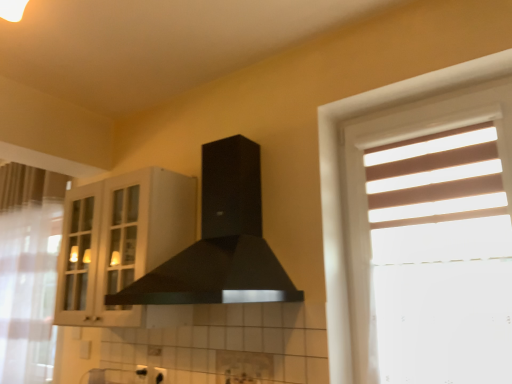
What is the approximate height of white sheer curtain at left?

It is 1.17 meters.

What do you see at coordinates (120, 241) in the screenshot?
I see `white glass cabinet at upper left` at bounding box center [120, 241].

The height and width of the screenshot is (384, 512). What do you see at coordinates (78, 256) in the screenshot?
I see `clear glass screen door at left` at bounding box center [78, 256].

Find the location of `white sheer curtain at left`. white sheer curtain at left is located at coordinates (28, 270).

Does point (70, 190) appear closer or farther from the camera than point (39, 317)?

Point (70, 190) appears to be closer to the viewer than point (39, 317).

Which is behind, white glass cabinet at upper left or white sheer curtain at left?

white sheer curtain at left is behind.

Is white glass cabinet at upper left spatially inside white sheer curtain at left, or outside of it?

white glass cabinet at upper left cannot be found inside white sheer curtain at left.

Is clear glass screen door at left a part of white glass cabinet at upper left?

That's incorrect, clear glass screen door at left is not inside white glass cabinet at upper left.

Consider the image. Are white glass cabinet at upper left and clear glass screen door at left making contact?

white glass cabinet at upper left and clear glass screen door at left are not in contact.

From a real-world perspective, is white glass cabinet at upper left beneath clear glass screen door at left?

Yes, from a real-world perspective, white glass cabinet at upper left is under clear glass screen door at left.

Can you confirm if white glass cabinet at upper left is thinner than clear glass screen door at left?

In fact, white glass cabinet at upper left might be wider than clear glass screen door at left.

In the scene shown: Between white glass cabinet at upper left and black matte fume hood at center, which one appears on the left side from the viewer's perspective?

white glass cabinet at upper left.

Considering the sizes of objects white glass cabinet at upper left and black matte fume hood at center in the image provided, who is smaller, white glass cabinet at upper left or black matte fume hood at center?

white glass cabinet at upper left.

Which is farther from the camera, [87,284] or [248,300]?

Point [87,284]

Considering the sizes of white glass cabinet at upper left and black matte fume hood at center in the image, is white glass cabinet at upper left taller or shorter than black matte fume hood at center?

In the image, white glass cabinet at upper left appears to be taller than black matte fume hood at center.

The image size is (512, 384). Identify the location of curtain below the clear glass screen door at left (from a real-world perspective). (28, 270).

Considering the relative sizes of white sheer curtain at left and clear glass screen door at left in the image provided, is white sheer curtain at left wider than clear glass screen door at left?

Yes, white sheer curtain at left is wider than clear glass screen door at left.

Can you confirm if white sheer curtain at left is smaller than clear glass screen door at left?

No, white sheer curtain at left is not smaller than clear glass screen door at left.

Can you tell me how much clear glass screen door at left and white sheer curtain at left differ in facing direction?

1.9 degrees separate the facing orientations of clear glass screen door at left and white sheer curtain at left.

Considering the sizes of objects clear glass screen door at left and white sheer curtain at left in the image provided, who is thinner, clear glass screen door at left or white sheer curtain at left?

clear glass screen door at left.

Which is behind, point (99, 191) or point (18, 282)?

The point (18, 282) is behind.

Considering the relative sizes of clear glass screen door at left and white sheer curtain at left in the image provided, is clear glass screen door at left shorter than white sheer curtain at left?

Correct, clear glass screen door at left is not as tall as white sheer curtain at left.

Is black matte fume hood at center not inside white sheer curtain at left?

Yes, black matte fume hood at center is not within white sheer curtain at left.

Does black matte fume hood at center turn towards white sheer curtain at left?

No, black matte fume hood at center does not turn towards white sheer curtain at left.

Consider the image. From a real-world perspective, is black matte fume hood at center physically located above or below white sheer curtain at left?

From a real-world perspective, black matte fume hood at center is physically above white sheer curtain at left.

Can you confirm if black matte fume hood at center is thinner than white sheer curtain at left?

Incorrect, the width of black matte fume hood at center is not less than that of white sheer curtain at left.

Is white sheer curtain at left inside or outside of black matte fume hood at center?

A: white sheer curtain at left is located beyond the bounds of black matte fume hood at center.

Does white sheer curtain at left have a larger size compared to black matte fume hood at center?

No.

How many degrees apart are the facing directions of white sheer curtain at left and black matte fume hood at center?

1.9 degrees.

Is white sheer curtain at left to the right of black matte fume hood at center from the viewer's perspective?

No, white sheer curtain at left is not to the right of black matte fume hood at center.

You are a GUI agent. You are given a task and a screenshot of the screen. Output one action in this format:
    pyautogui.click(x=<x>, y=<y>)
    Task: Click on the cabinetry above the white sheer curtain at left (from a real-world perspective)
    Image resolution: width=512 pixels, height=384 pixels.
    Given the screenshot: What is the action you would take?
    pyautogui.click(x=120, y=241)

Identify the location of cabinetry that is on the right side of clear glass screen door at left. Image resolution: width=512 pixels, height=384 pixels. (120, 241).

Based on their spatial positions, is white glass cabinet at upper left or clear glass screen door at left further from black matte fume hood at center?

The object further to black matte fume hood at center is clear glass screen door at left.

Looking at the image, which one is located closer to white sheer curtain at left, clear glass screen door at left or black matte fume hood at center?

clear glass screen door at left is closer to white sheer curtain at left.

When comparing their distances from clear glass screen door at left, does white glass cabinet at upper left or black matte fume hood at center seem closer?

white glass cabinet at upper left.

When comparing their distances from white sheer curtain at left, does clear glass screen door at left or white glass cabinet at upper left seem closer?

The object closer to white sheer curtain at left is clear glass screen door at left.

When comparing their distances from clear glass screen door at left, does white sheer curtain at left or black matte fume hood at center seem further?

white sheer curtain at left is positioned further to the anchor clear glass screen door at left.

From the image, which object appears to be farther from white glass cabinet at upper left, black matte fume hood at center or clear glass screen door at left?

The object further to white glass cabinet at upper left is black matte fume hood at center.

Consider the image. Estimate the real-world distances between objects in this image. Which object is closer to clear glass screen door at left, white glass cabinet at upper left or white sheer curtain at left?

Based on the image, white glass cabinet at upper left appears to be nearer to clear glass screen door at left.

In the scene shown: Which object lies nearer to the anchor point clear glass screen door at left, black matte fume hood at center or white sheer curtain at left?

The object closer to clear glass screen door at left is black matte fume hood at center.

The width and height of the screenshot is (512, 384). Find the location of `cabinetry between white sheer curtain at left and black matte fume hood at center in the horizontal direction`. cabinetry between white sheer curtain at left and black matte fume hood at center in the horizontal direction is located at coordinates (120, 241).

At what (x,y) coordinates should I click in order to perform the action: click on screen door between white sheer curtain at left and white glass cabinet at upper left. Please return your answer as a coordinate pair (x, y). Image resolution: width=512 pixels, height=384 pixels. Looking at the image, I should click on (78, 256).

You are a GUI agent. You are given a task and a screenshot of the screen. Output one action in this format:
    pyautogui.click(x=<x>, y=<y>)
    Task: Click on the cabinetry located between black matte fume hood at center and clear glass screen door at left in the depth direction
    Image resolution: width=512 pixels, height=384 pixels.
    Given the screenshot: What is the action you would take?
    pyautogui.click(x=120, y=241)

This screenshot has height=384, width=512. I want to click on screen door between white sheer curtain at left and black matte fume hood at center from left to right, so click(78, 256).